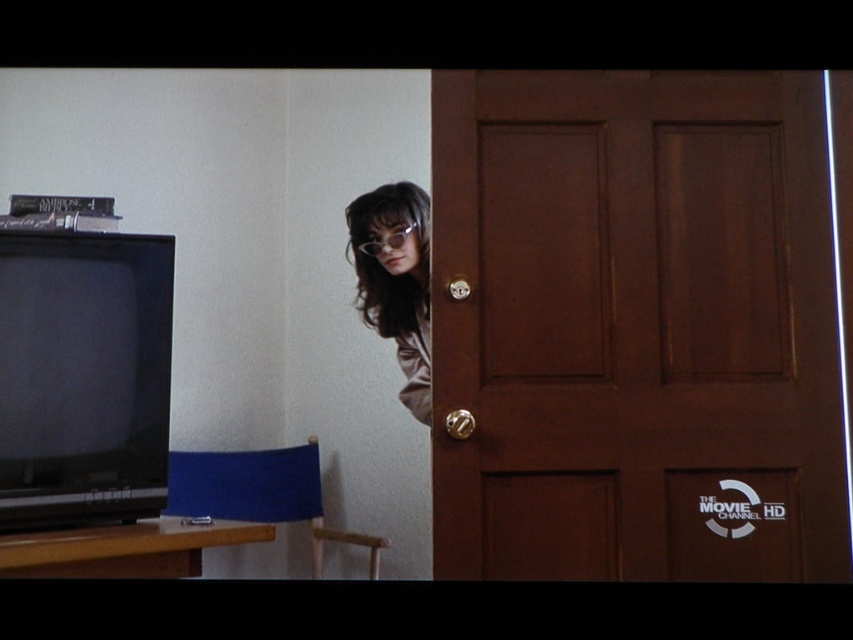
You are trying to decide whether to place a decorative plate that is 12 inches wide on the space between the black matte television at left and the gold metallic door handle at center. Based on the scene, will the plate fit?

The black matte television at left is wider than the gold metallic door handle at center. However, the exact distance between them isn t specified in the objects description. Without knowing the space between them, it s impossible to determine if the 12 inch plate will fit.

You are an interior designer assessing the space between the brown wooden door at center and the gold metallic door handle at center. Which object is wider?

The brown wooden door at center is wider than the gold metallic door handle at center.